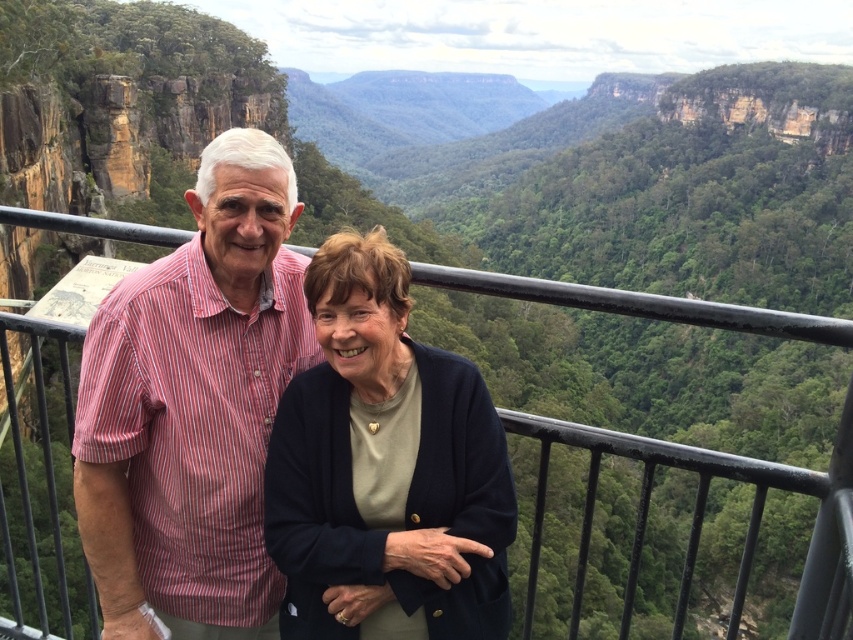
Consider the image. Does striped cotton shirt at left appear over dark blue sweater at center?

Yes, striped cotton shirt at left is above dark blue sweater at center.

Between striped cotton shirt at left and dark blue sweater at center, which one has less height?

With less height is dark blue sweater at center.

Is point (73, 436) behind point (398, 273)?

No, it is not.

Identify the location of striped cotton shirt at left. (194, 406).

Based on the photo, is dark blue sweater at center further to the viewer compared to black metal railing at upper center?

Yes, dark blue sweater at center is behind black metal railing at upper center.

Which is behind, point (297, 448) or point (827, 572)?

Point (297, 448)

The image size is (853, 640). In order to click on dark blue sweater at center in this screenshot , I will do `click(386, 467)`.

Between striped cotton shirt at left and black metal railing at upper center, which one has more height?

black metal railing at upper center is taller.

Who is lower down, striped cotton shirt at left or black metal railing at upper center?

striped cotton shirt at left

At what (x,y) coordinates should I click in order to perform the action: click on striped cotton shirt at left. Please return your answer as a coordinate pair (x, y). The width and height of the screenshot is (853, 640). Looking at the image, I should click on (194, 406).

This screenshot has width=853, height=640. Find the location of `striped cotton shirt at left`. striped cotton shirt at left is located at coordinates coord(194,406).